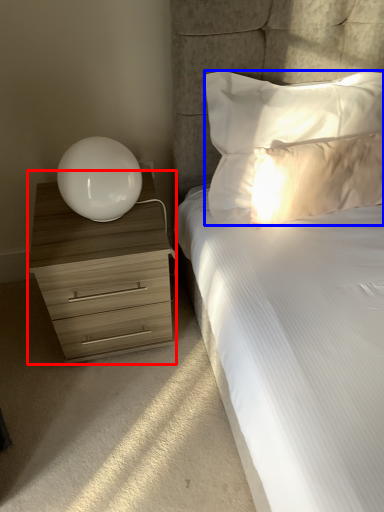
Question: Which object appears farthest to the camera in this image, chest of drawers (highlighted by a red box) or pillow (highlighted by a blue box)?

Choices:
 (A) chest of drawers
 (B) pillow

Answer: (A)